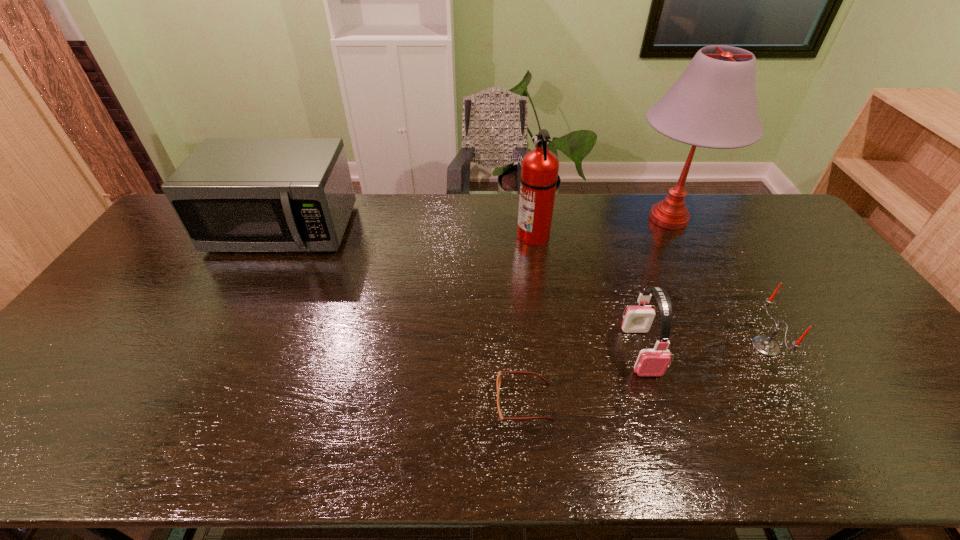
Find the location of a particular element. The height and width of the screenshot is (540, 960). vacant area at the right edge of the desktop is located at coordinates (772, 235).

Locate an element on the screen. The image size is (960, 540). free space at the near right corner of the desktop is located at coordinates (959, 461).

Locate an element on the screen. free space between the earphone and the second tallest object is located at coordinates (587, 293).

Find the location of a particular element. The height and width of the screenshot is (540, 960). free space between the table lamp and the nearest object is located at coordinates (596, 310).

Find the location of `free space between the tallest object and the spectacles`. free space between the tallest object and the spectacles is located at coordinates (596, 310).

The width and height of the screenshot is (960, 540). I want to click on vacant space in between the fourth shortest object and the earphone, so 462,290.

Where is `vacant space that's between the fifth shortest object and the table lamp`? This screenshot has width=960, height=540. vacant space that's between the fifth shortest object and the table lamp is located at coordinates (601, 227).

You are a GUI agent. You are given a task and a screenshot of the screen. Output one action in this format:
    pyautogui.click(x=<x>, y=<y>)
    Task: Click on the unoccupied area between the table lamp and the fifth tallest object
    The image size is (960, 540).
    Given the screenshot: What is the action you would take?
    pyautogui.click(x=717, y=282)

I want to click on unoccupied area between the tallest object and the candle, so click(x=717, y=282).

Locate an element on the screen. The image size is (960, 540). unoccupied position between the tallest object and the leftmost object is located at coordinates (476, 224).